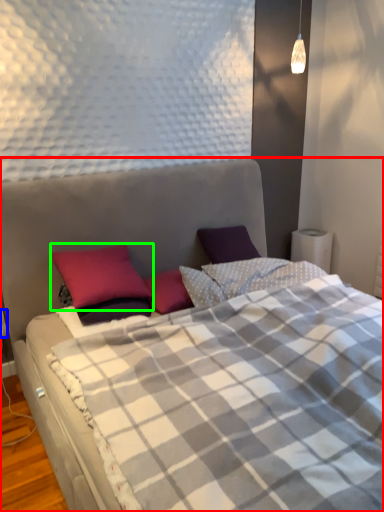
Question: Which is nearer to the bed (highlighted by a red box)? electric outlet (highlighted by a blue box) or pillow (highlighted by a green box).

Choices:
 (A) electric outlet
 (B) pillow

Answer: (B)